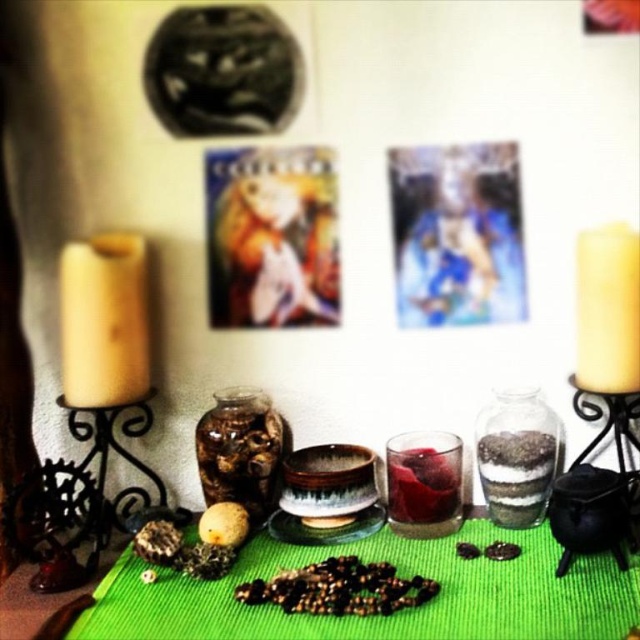
Question: Among these points, which one is farthest from the camera?

Choices:
 (A) click(212, 467)
 (B) click(76, 296)

Answer: (A)

Question: Which of the following is the closest to the observer?

Choices:
 (A) translucent glass jar at center-right
 (B) green felt table at center
 (C) blue fabric picture frame at upper center

Answer: (B)

Question: Estimate the real-world distances between objects in this image. Which object is farther from the transparent glass at center?

Choices:
 (A) translucent glass jar at center-right
 (B) blue fabric picture frame at upper center
 (C) metallic gold frame at center

Answer: (C)

Question: Does green felt table at center come behind transparent glass at center?

Choices:
 (A) yes
 (B) no

Answer: (B)

Question: Is metallic gold frame at center in front of transparent glass at center?

Choices:
 (A) yes
 (B) no

Answer: (B)

Question: Does metallic gold frame at center appear under transparent glass at center?

Choices:
 (A) yes
 (B) no

Answer: (B)